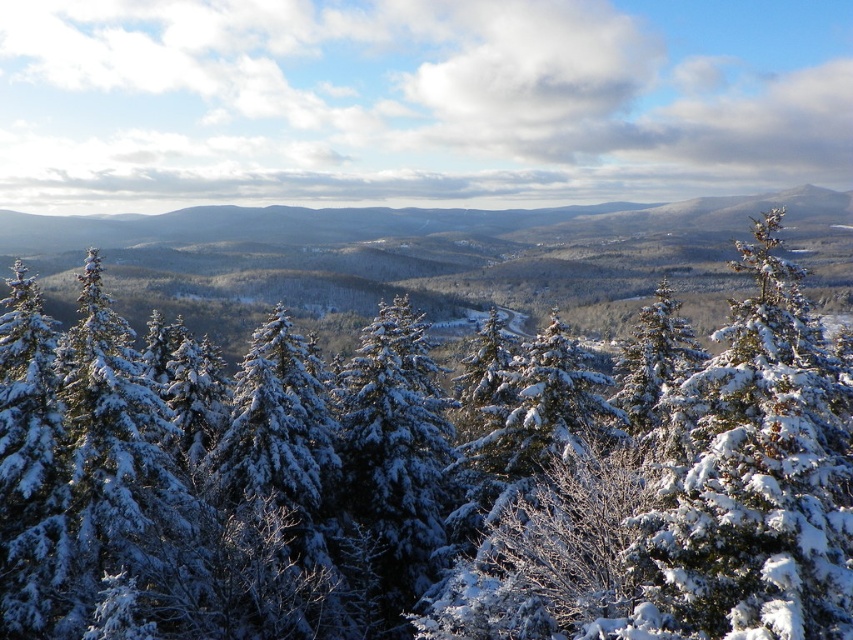
Question: Among these objects, which one is nearest to the camera?

Choices:
 (A) white snow-covered mountain at center
 (B) green textured pine at center

Answer: (B)

Question: Estimate the real-world distances between objects in this image. Which object is farther from the white snow-covered mountain at center?

Choices:
 (A) green textured pine at center
 (B) snow-covered evergreen at center-right

Answer: (B)

Question: Is green textured pine at center above white snow-covered mountain at center?

Choices:
 (A) no
 (B) yes

Answer: (A)

Question: Is green textured pine at center below snow-covered evergreen at center-right?

Choices:
 (A) no
 (B) yes

Answer: (B)

Question: Does green textured pine at center have a lesser width compared to white snow-covered mountain at center?

Choices:
 (A) yes
 (B) no

Answer: (A)

Question: Which object appears farthest from the camera in this image?

Choices:
 (A) white snow-covered mountain at center
 (B) green textured pine at center
 (C) snow-covered evergreen at center-right

Answer: (A)